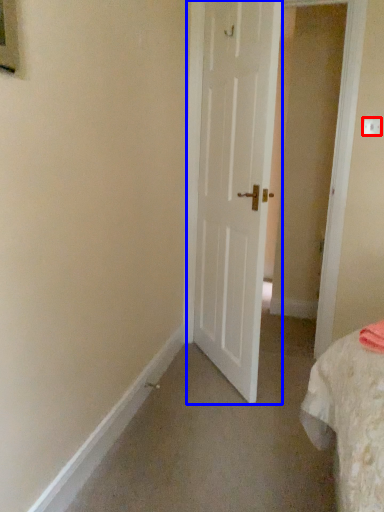
Question: Which object appears closest to the camera in this image, electric outlet (highlighted by a red box) or door (highlighted by a blue box)?

Choices:
 (A) electric outlet
 (B) door

Answer: (B)